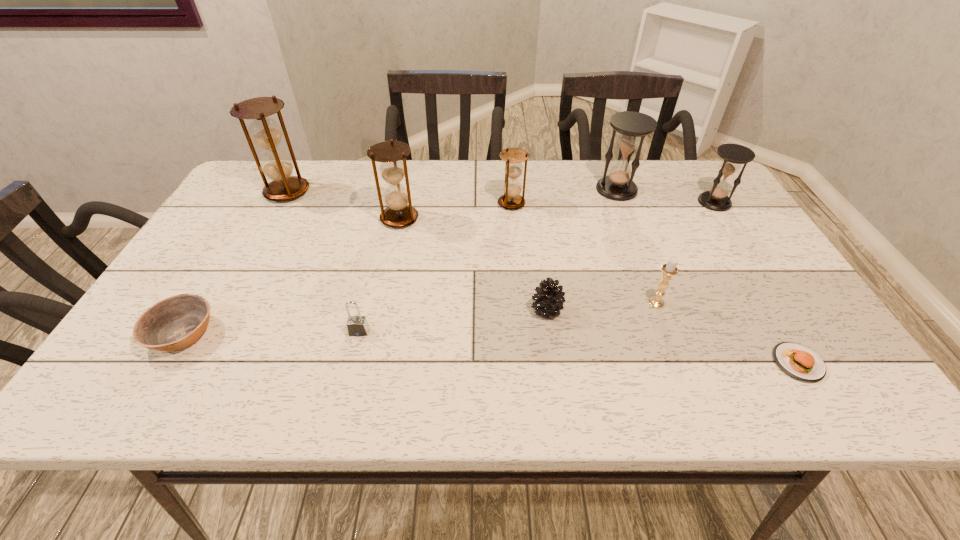
At what (x,y) coordinates should I click in order to perform the action: click on hourglass that stands as the third closest to the fourth hourglass from right to left. Please return your answer as a coordinate pair (x, y). The image size is (960, 540). Looking at the image, I should click on (632, 127).

Identify which hourglass is the second closest to the fourth hourglass from left to right. Please provide its 2D coordinates. Your answer should be formatted as a tuple, i.e. [(x, y)], where the tuple contains the x and y coordinates of a point satisfying the conditions above.

[(511, 199)]

Locate which brown hourglass ranks third in proximity to the shortest object. Please provide its 2D coordinates. Your answer should be formatted as a tuple, i.e. [(x, y)], where the tuple contains the x and y coordinates of a point satisfying the conditions above.

[(276, 165)]

You are a GUI agent. You are given a task and a screenshot of the screen. Output one action in this format:
    pyautogui.click(x=<x>, y=<y>)
    Task: Click on the brown hourglass that is the closest to the pinecone
    The width and height of the screenshot is (960, 540).
    Given the screenshot: What is the action you would take?
    pyautogui.click(x=511, y=199)

The height and width of the screenshot is (540, 960). In order to click on free space that satisfies the following two spatial constraints: 1. on the front side of the second biggest brown hourglass; 2. on the right side of the food in this screenshot , I will do `click(369, 363)`.